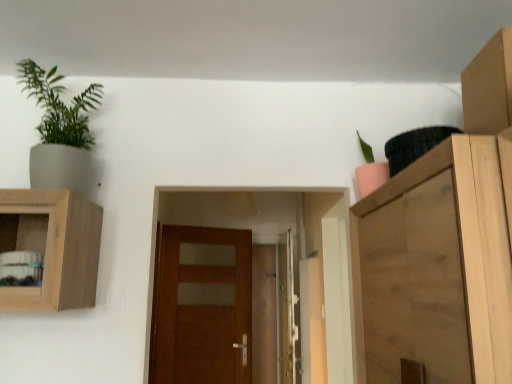
Question: Which direction should I rotate to face brown wooden door at center, which appears as the 1th door when viewed from the back, — up or down?

Choices:
 (A) up
 (B) down

Answer: (B)

Question: Is cardboard box at upper right wider than brown wooden door at center, the 2th door viewed from the back?

Choices:
 (A) yes
 (B) no

Answer: (A)

Question: From the image's perspective, is cardboard box at upper right located above brown wooden door at center, which ranks as the 1th door in front-to-back order?

Choices:
 (A) yes
 (B) no

Answer: (A)

Question: Does cardboard box at upper right lie behind brown wooden door at center, which ranks as the 1th door in front-to-back order?

Choices:
 (A) yes
 (B) no

Answer: (B)

Question: Does cardboard box at upper right have a smaller size compared to brown wooden door at center, which ranks as the 1th door in front-to-back order?

Choices:
 (A) no
 (B) yes

Answer: (B)

Question: Considering the relative sizes of cardboard box at upper right and brown wooden door at center, which ranks as the 1th door in front-to-back order, in the image provided, is cardboard box at upper right shorter than brown wooden door at center, which ranks as the 1th door in front-to-back order,?

Choices:
 (A) no
 (B) yes

Answer: (B)

Question: Is cardboard box at upper right not within brown wooden door at center, the 2th door viewed from the back?

Choices:
 (A) no
 (B) yes

Answer: (B)

Question: From the image's perspective, does metallic silver screen door at center appear lower than wooden cabinet at right?

Choices:
 (A) yes
 (B) no

Answer: (A)

Question: Considering the relative sizes of metallic silver screen door at center and wooden cabinet at right in the image provided, is metallic silver screen door at center shorter than wooden cabinet at right?

Choices:
 (A) yes
 (B) no

Answer: (B)

Question: Can you confirm if metallic silver screen door at center is positioned to the left of wooden cabinet at right?

Choices:
 (A) no
 (B) yes

Answer: (B)

Question: Is metallic silver screen door at center thinner than wooden cabinet at right?

Choices:
 (A) no
 (B) yes

Answer: (B)

Question: Does metallic silver screen door at center have a greater width compared to wooden cabinet at right?

Choices:
 (A) yes
 (B) no

Answer: (B)

Question: Is the surface of metallic silver screen door at center in direct contact with wooden cabinet at right?

Choices:
 (A) yes
 (B) no

Answer: (B)

Question: Is cardboard box at upper right positioned behind pink matte pot at upper right, the first houseplant viewed from the right?

Choices:
 (A) yes
 (B) no

Answer: (B)